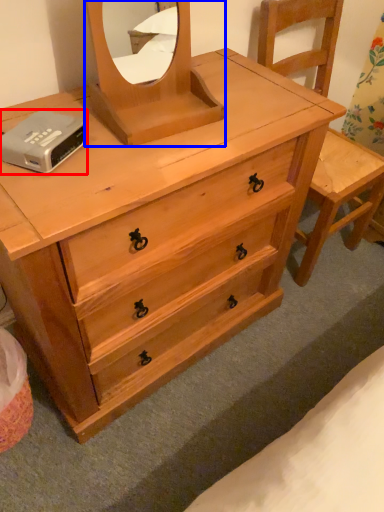
Question: Which object appears closest to the camera in this image, hardware (highlighted by a red box) or mirror (highlighted by a blue box)?

Choices:
 (A) hardware
 (B) mirror

Answer: (B)